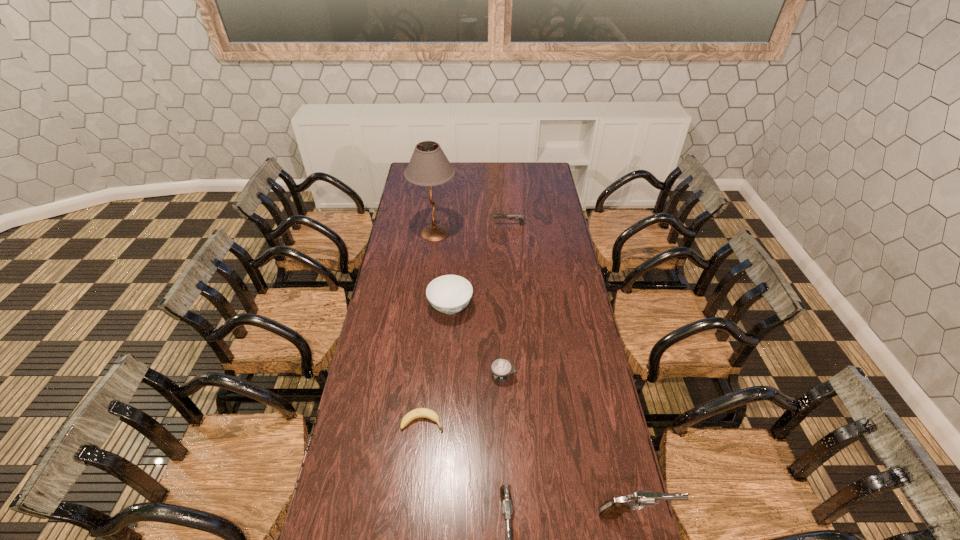
Where is `object positioned at the near right corner`? The width and height of the screenshot is (960, 540). object positioned at the near right corner is located at coordinates (611, 509).

This screenshot has height=540, width=960. What are the coordinates of `vacant space at the far edge of the desktop` in the screenshot? It's located at (485, 170).

Locate an element on the screen. vacant area at the left edge is located at coordinates (401, 209).

At what (x,y) coordinates should I click in order to perform the action: click on vacant region at the right edge. Please return your answer as a coordinate pair (x, y). This screenshot has width=960, height=540. Looking at the image, I should click on (553, 288).

Image resolution: width=960 pixels, height=540 pixels. I want to click on vacant region at the near left corner of the desktop, so click(x=342, y=502).

In the image, there is a desktop. At what (x,y) coordinates should I click in order to perform the action: click on free space at the far right corner. Please return your answer as a coordinate pair (x, y). This screenshot has width=960, height=540. Looking at the image, I should click on (547, 172).

I want to click on blank region between the third shortest object and the fifth nearest object, so click(480, 266).

Find the location of a particular element. Image resolution: width=960 pixels, height=540 pixels. free area in between the banana and the fourth nearest object is located at coordinates (463, 398).

Locate an element on the screen. The image size is (960, 540). vacant space that's between the banana and the right pistol is located at coordinates (529, 468).

Where is `vacant area between the fourth shortest object and the tallest object`? Image resolution: width=960 pixels, height=540 pixels. vacant area between the fourth shortest object and the tallest object is located at coordinates (443, 270).